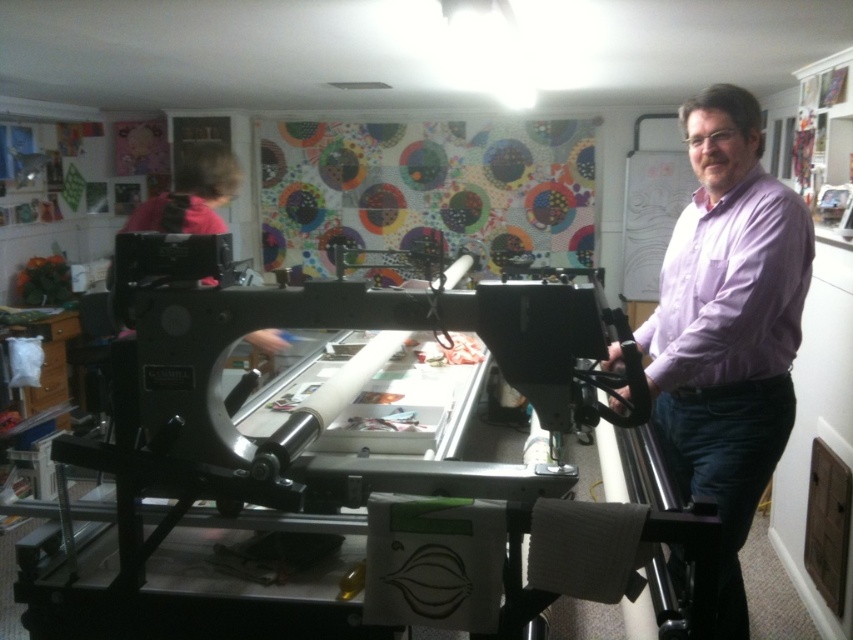
Between metallic silver sewing machine at center and purple cotton shirt at right, which one is positioned higher?

Positioned higher is purple cotton shirt at right.

Is point (172, 525) positioned after point (703, 384)?

No, it is in front of (703, 384).

Where is `metallic silver sewing machine at center`? metallic silver sewing machine at center is located at coordinates (318, 465).

Describe the element at coordinates (728, 326) in the screenshot. Image resolution: width=853 pixels, height=640 pixels. I see `purple cotton shirt at center` at that location.

Can you confirm if purple cotton shirt at center is positioned above purple cotton shirt at right?

No.

The image size is (853, 640). In order to click on purple cotton shirt at center in this screenshot , I will do `click(728, 326)`.

The width and height of the screenshot is (853, 640). I want to click on purple cotton shirt at center, so click(x=728, y=326).

Between metallic silver sewing machine at center and purple cotton shirt at center, which one has more height?

purple cotton shirt at center

The height and width of the screenshot is (640, 853). I want to click on metallic silver sewing machine at center, so click(x=318, y=465).